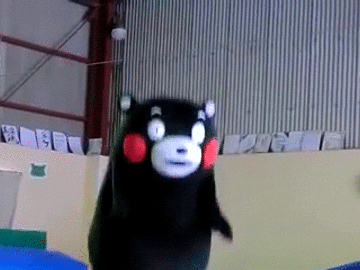
This screenshot has height=270, width=360. Identify the location of picture frame on the right. (337, 135).